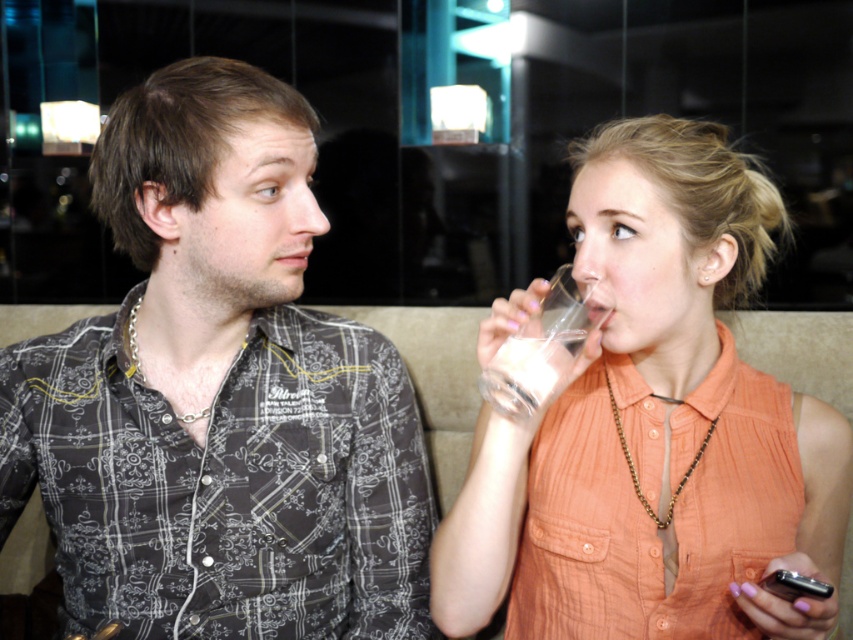
Does patterned fabric shirt at center appear on the right side of matte orange shirt at right?

Incorrect, patterned fabric shirt at center is not on the right side of matte orange shirt at right.

Is patterned fabric shirt at center above matte orange shirt at right?

Indeed, patterned fabric shirt at center is positioned over matte orange shirt at right.

Which is behind, point (271, 77) or point (643, 241)?

Positioned behind is point (271, 77).

The image size is (853, 640). Identify the location of patterned fabric shirt at center. (219, 396).

Is patterned fabric shirt at center wider than clear glass at upper right?

Correct, the width of patterned fabric shirt at center exceeds that of clear glass at upper right.

Locate an element on the screen. The height and width of the screenshot is (640, 853). patterned fabric shirt at center is located at coordinates (219, 396).

Who is positioned more to the left, matte orange shirt at right or clear glass at upper right?

clear glass at upper right

Can you confirm if matte orange shirt at right is thinner than clear glass at upper right?

No.

The image size is (853, 640). What do you see at coordinates (654, 428) in the screenshot?
I see `matte orange shirt at right` at bounding box center [654, 428].

This screenshot has height=640, width=853. I want to click on matte orange shirt at right, so click(654, 428).